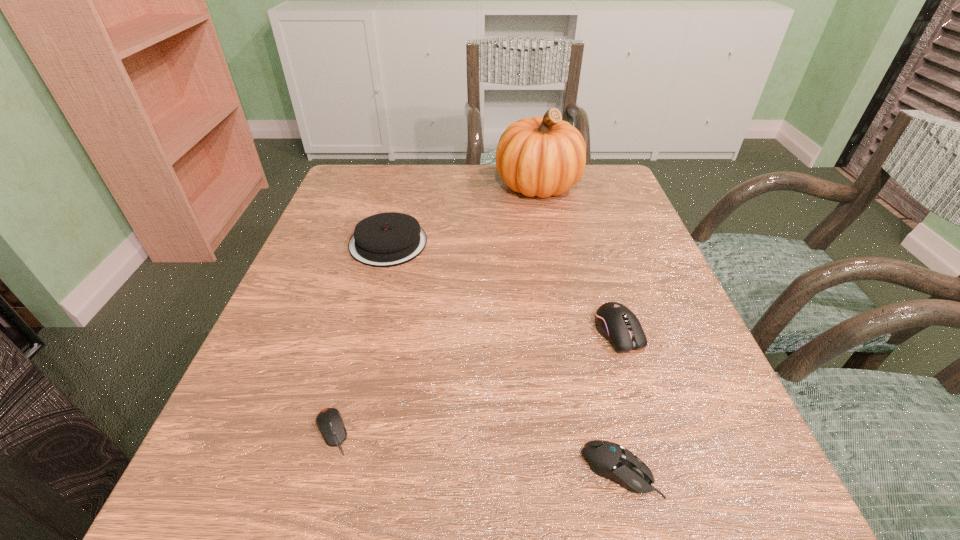
I want to click on free region at the far edge of the desktop, so click(x=463, y=171).

The width and height of the screenshot is (960, 540). I want to click on free space at the left edge of the desktop, so click(x=280, y=315).

This screenshot has height=540, width=960. I want to click on free region at the right edge of the desktop, so click(653, 255).

You are a GUI agent. You are given a task and a screenshot of the screen. Output one action in this format:
    pyautogui.click(x=<x>, y=<y>)
    Task: Click on the free space at the far left corner
    The height and width of the screenshot is (540, 960).
    Given the screenshot: What is the action you would take?
    pyautogui.click(x=378, y=181)

The image size is (960, 540). I want to click on blank space at the near left corner, so click(204, 539).

Where is `free region at the far right corner of the desktop`? free region at the far right corner of the desktop is located at coordinates (627, 206).

You are a GUI agent. You are given a task and a screenshot of the screen. Output one action in this format:
    pyautogui.click(x=<x>, y=<y>)
    Task: Click on the vacant space at the near right corner of the desktop
    
    Given the screenshot: What is the action you would take?
    656,507

You are a GUI agent. You are given a task and a screenshot of the screen. Output one action in this format:
    pyautogui.click(x=<x>, y=<y>)
    Task: Click on the vacant point located between the second shortest object and the shortest object
    The image size is (960, 540).
    Given the screenshot: What is the action you would take?
    pyautogui.click(x=476, y=451)

Where is `empty location between the tallest computer mouse and the fourth tallest object`? The width and height of the screenshot is (960, 540). empty location between the tallest computer mouse and the fourth tallest object is located at coordinates (619, 402).

Where is `vacant area that lies between the shortest object and the pancake`? vacant area that lies between the shortest object and the pancake is located at coordinates (360, 338).